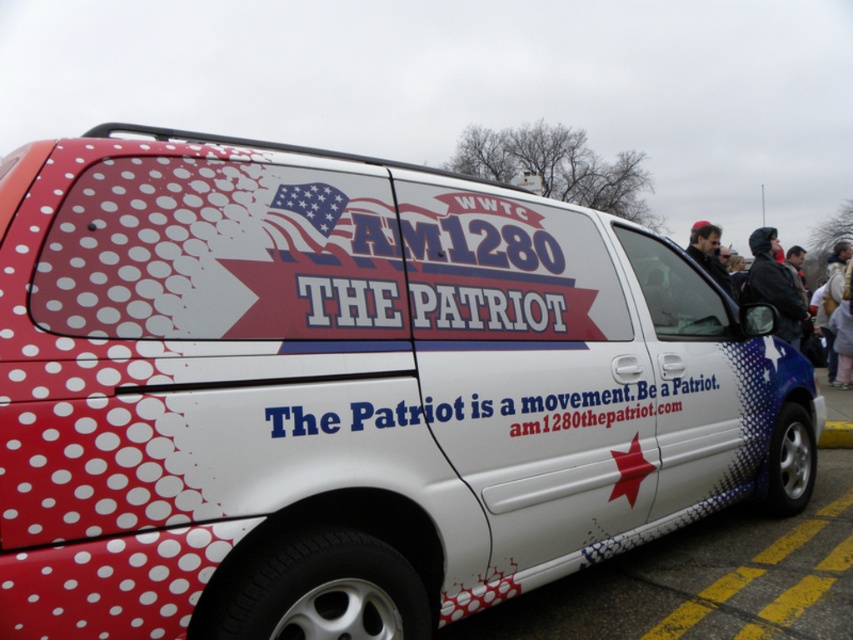
Question: Among these objects, which one is nearest to the camera?

Choices:
 (A) dark blue jacket at right
 (B) white vinyl text at center
 (C) black leather jacket at right

Answer: (B)

Question: Is white glossy van at lower right positioned before black leather jacket at right?

Choices:
 (A) no
 (B) yes

Answer: (B)

Question: Where is dark blue jacket at right located in relation to black leather jacket at right in the image?

Choices:
 (A) above
 (B) below

Answer: (A)

Question: Is white glossy van at lower right above dark blue jacket at right?

Choices:
 (A) no
 (B) yes

Answer: (A)

Question: Which of the following is the farthest from the observer?

Choices:
 (A) white vinyl text at center
 (B) black leather jacket at right
 (C) white glossy van at lower right

Answer: (B)

Question: Which of the following is the closest to the observer?

Choices:
 (A) coord(511,435)
 (B) coord(780,282)
 (C) coord(746,301)

Answer: (A)